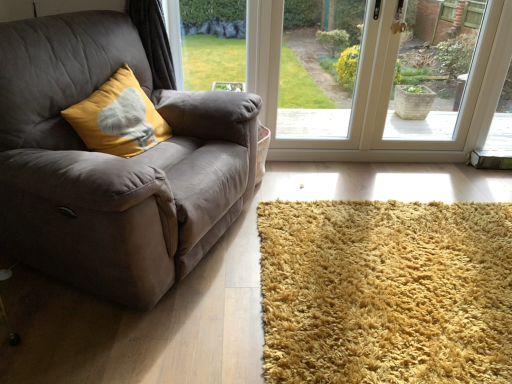
Question: Can you confirm if transparent glass door at center, acting as the 2th window screen starting from the right, is smaller than transparent glass window at center?

Choices:
 (A) no
 (B) yes

Answer: (B)

Question: Could you tell me if transparent glass door at center, acting as the 2th window screen starting from the right, is turned towards transparent glass window at center?

Choices:
 (A) no
 (B) yes

Answer: (B)

Question: Can you confirm if transparent glass door at center, the second window screen positioned from the left, is bigger than transparent glass window at center?

Choices:
 (A) yes
 (B) no

Answer: (B)

Question: From the image's perspective, is transparent glass door at center, acting as the 2th window screen starting from the right, over transparent glass window at center?

Choices:
 (A) yes
 (B) no

Answer: (A)

Question: Is transparent glass door at center, the second window screen positioned from the left, thinner than transparent glass window at center?

Choices:
 (A) no
 (B) yes

Answer: (A)

Question: Is transparent glass door at center, acting as the 2th window screen starting from the right, shorter than transparent glass window at center?

Choices:
 (A) no
 (B) yes

Answer: (B)

Question: Does mustard velvet cushion at left turn towards white textured basket at upper right, the 1th window screen when ordered from right to left?

Choices:
 (A) no
 (B) yes

Answer: (A)

Question: Can you confirm if mustard velvet cushion at left is shorter than white textured basket at upper right, the 1th window screen when ordered from right to left?

Choices:
 (A) yes
 (B) no

Answer: (A)

Question: Is mustard velvet cushion at left located outside white textured basket at upper right, the 3th window screen positioned from the left?

Choices:
 (A) no
 (B) yes

Answer: (B)

Question: Is white textured basket at upper right, the 1th window screen when ordered from right to left, inside mustard velvet cushion at left?

Choices:
 (A) no
 (B) yes

Answer: (A)

Question: Does mustard velvet cushion at left appear on the left side of white textured basket at upper right, the 1th window screen when ordered from right to left?

Choices:
 (A) no
 (B) yes

Answer: (B)

Question: From the image's perspective, is mustard velvet cushion at left under white textured basket at upper right, the 1th window screen when ordered from right to left?

Choices:
 (A) no
 (B) yes

Answer: (B)

Question: Considering the relative sizes of transparent glass window at center and green grass at upper center, the 3th window screen from the right, in the image provided, is transparent glass window at center taller than green grass at upper center, the 3th window screen from the right,?

Choices:
 (A) no
 (B) yes

Answer: (B)